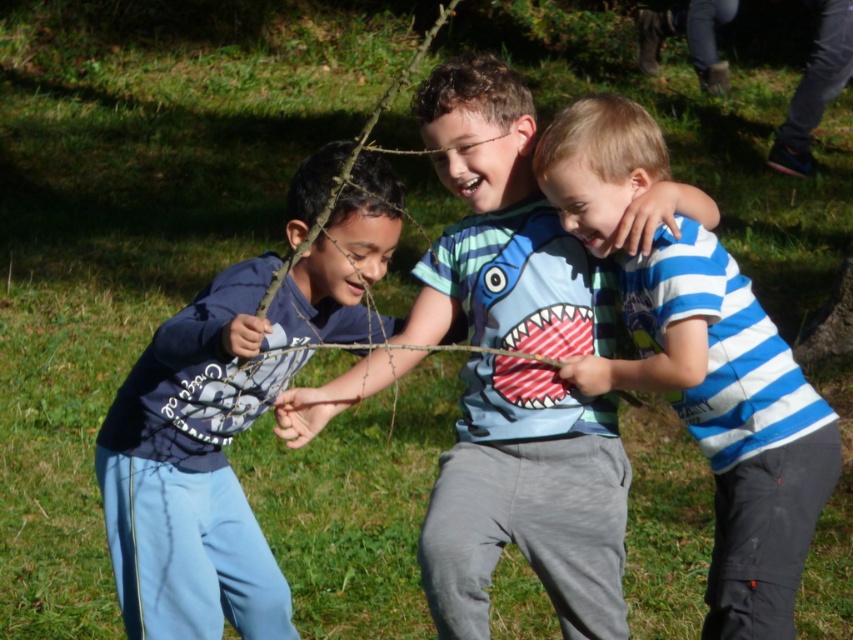
You are a photographer trying to capture a group photo of the blue cotton shirt at center and the blue striped shirt at right. Since you want to ensure both subjects appear balanced in the photo, which subject should you place closer to the camera to compensate for their size difference?

The blue striped shirt at right should be placed closer to the camera because it is smaller in size compared to the blue cotton shirt at center, so moving it forward will help balance their apparent sizes in the photo.

You are a photographer trying to capture a group photo of the blue striped shirt at center and the blue striped shirt at right. Since you want to ensure both are clearly visible, which child should you position closer to the camera to avoid any overlap?

The blue striped shirt at right should be positioned closer to the camera because the blue striped shirt at center is larger and would otherwise block the smaller one.